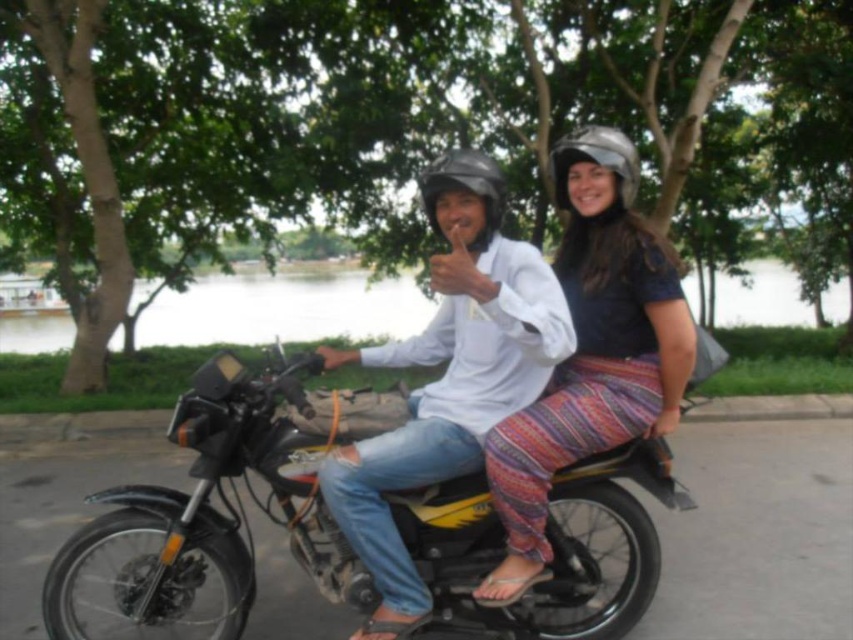
You are a photographer trying to capture a photo of the two points mentioned in the scene. Which point, point (322,474) or point (572,157), is positioned closer to the camera?

Point (322,474) is closer to the camera than point (572,157).

You are a photographer trying to capture a closeup of the white matte shirt at center and the metallic silver helmet at upper right in the image. Since you want both objects to be clearly visible, which object should you focus on first to ensure proper focus, considering their sizes?

The white matte shirt at center has a greater width than the metallic silver helmet at upper right, so you should focus on the white matte shirt at center first to ensure proper focus as it occupies more space in the frame.